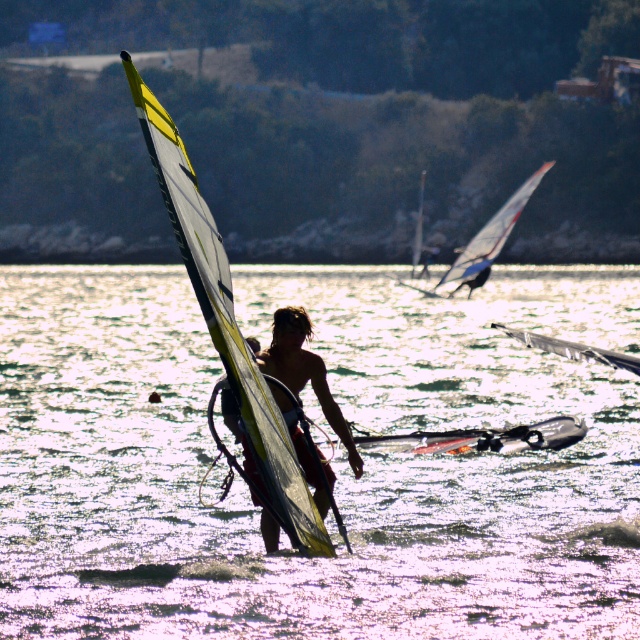
You are a photographer trying to capture the windsurfing scene. You notice the yellow and white sail at center and the shiny silver surfboard at center. Which object should you focus on first if you want to capture the one that is higher in the frame?

The yellow and white sail at center is located above the shiny silver surfboard at center, so you should focus on the yellow and white sail at center first to capture the higher object.

In the scene shown: You are standing at the point marked as point (556,449). The nearest windsurfer is 66.74 feet away. If you can walk 10 feet per minute, how many minutes will it take you to reach the nearest windsurfer?

The nearest windsurfer is 66.74 feet away, and you walk at 10 feet per minute. Dividing 66.74 by 10 gives approximately 6.674 minutes, so it would take roughly 6.7 minutes to reach them.

From the picture: You are a photographer trying to capture the white glossy sail at upper center and the translucent plastic water at center in your shot. Based on their positions, which object should you adjust your camera focus to first if you want to ensure both are in focus?

The translucent plastic water at center is to the left of the white glossy sail at upper center, so you should focus on the translucent plastic water at center first as it is closer to the camera.